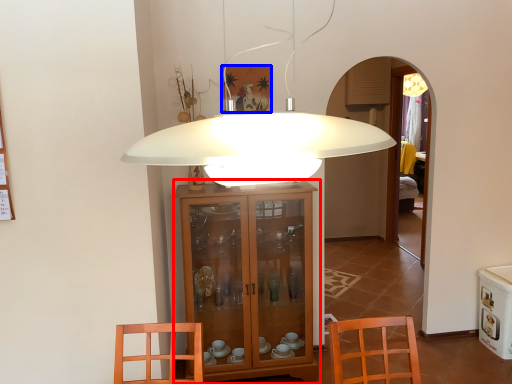
Question: Among these objects, which one is nearest to the camera, cabinetry (highlighted by a red box) or picture frame (highlighted by a blue box)?

Choices:
 (A) cabinetry
 (B) picture frame

Answer: (A)